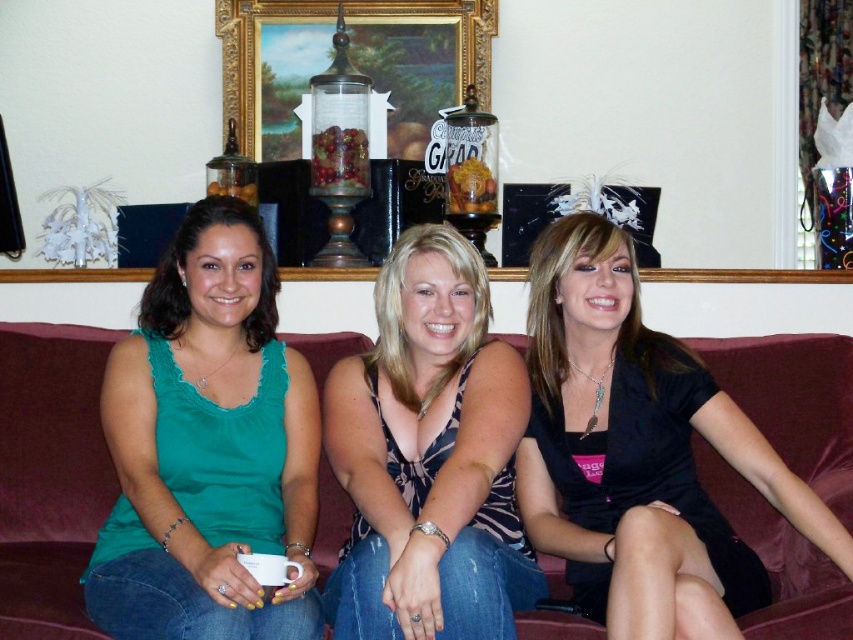
You are organizing a clothing donation drive and need to determine which of the two items at the center of the image is more suitable for a child. The items are the green fabric tank top at center and the black satin dress at center. Based on their sizes, which one would you choose?

The green fabric tank top at center has a smaller size compared to the black satin dress at center, so the green fabric tank top at center is more suitable for a child.

Looking at this image, you are trying to decide which tank top to wear for a casual day out. Both the green fabric tank top at center and the printed fabric tank top at center are options. Based on their sizes, which one would you choose if you prefer a more oversized look?

The green fabric tank top at center is bigger than the printed fabric tank top at center, so you should choose the green fabric tank top at center for a more oversized look.

You are a photographer setting up a shoot in the living room. You need to ensure that the green fabric tank top at center and the printed fabric tank top at center are visible in the frame. Based on their sizes, which tank top should you focus on to ensure both are fully visible?

The green fabric tank top at center is much taller than the printed fabric tank top at center, so focusing on the green fabric tank top at center would ensure both are fully visible since it requires more vertical space.